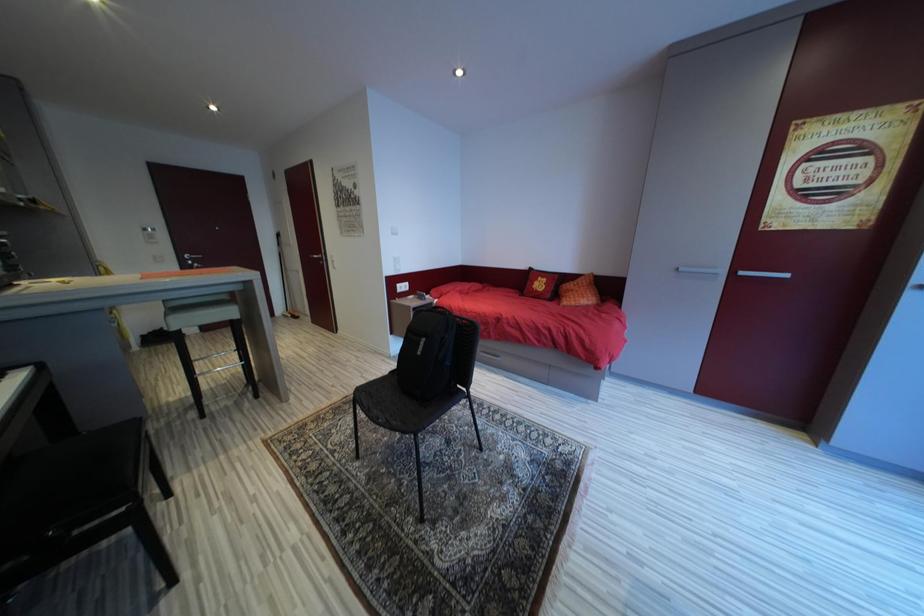
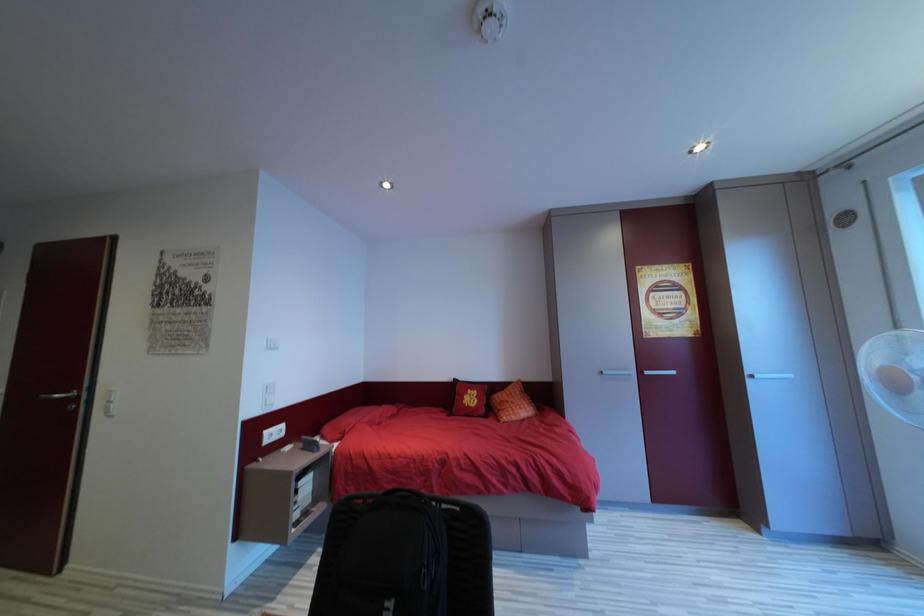
How did the camera likely rotate?

The camera's rotation is toward right-up.